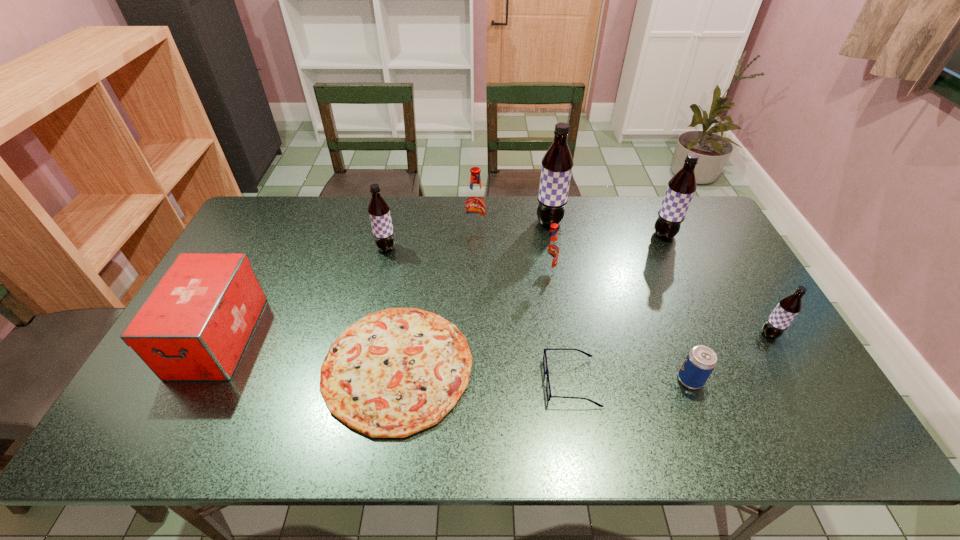
The width and height of the screenshot is (960, 540). In order to click on free space between the biggest brown root beer and the first-aid kit in this screenshot , I will do `click(384, 280)`.

In order to click on vacant area that lies between the fifth root beer from left to right and the tallest object in this screenshot , I will do `click(607, 229)`.

Locate an element on the screen. free space between the spectacles and the third object from right to left is located at coordinates (631, 381).

Find the location of a particular element. The height and width of the screenshot is (540, 960). vacant area that lies between the bigger red root beer and the beer can is located at coordinates (583, 305).

This screenshot has height=540, width=960. Find the location of `free space between the pizza and the third smallest brown root beer`. free space between the pizza and the third smallest brown root beer is located at coordinates (531, 301).

You are a GUI agent. You are given a task and a screenshot of the screen. Output one action in this format:
    pyautogui.click(x=<x>, y=<y>)
    Task: Click on the unoccupied position between the smallest brown root beer and the farther red root beer
    
    Given the screenshot: What is the action you would take?
    pyautogui.click(x=623, y=282)

What are the coordinates of `object that stands as the closest to the nearer red root beer` in the screenshot? It's located at tap(557, 163).

Identify which object is the seventh nearest to the ninth shortest object. Please provide its 2D coordinates. Your answer should be formatted as a tuple, i.e. [(x, y)], where the tuple contains the x and y coordinates of a point satisfying the conditions above.

[(395, 372)]

At what (x,y) coordinates should I click in order to perform the action: click on the third closest root beer relative to the spectacles. Please return your answer as a coordinate pair (x, y). The image size is (960, 540). Looking at the image, I should click on (475, 201).

Locate which root beer ranks fourth in proximity to the first-aid kit. Please provide its 2D coordinates. Your answer should be formatted as a tuple, i.e. [(x, y)], where the tuple contains the x and y coordinates of a point satisfying the conditions above.

[(557, 163)]